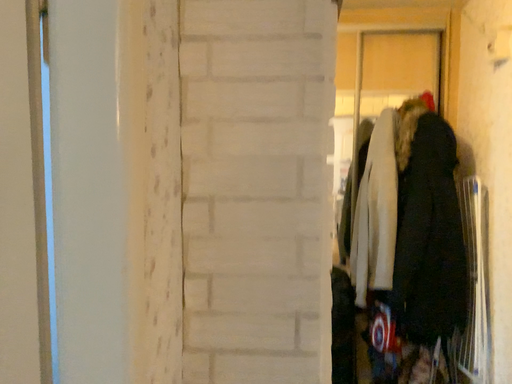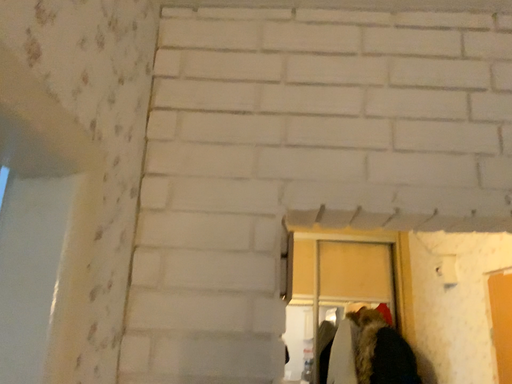
Question: Which way did the camera rotate in the video?

Choices:
 (A) rotated downward
 (B) rotated upward

Answer: (B)